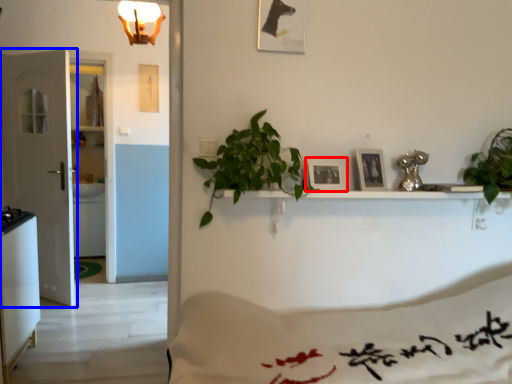
Question: Which object appears closest to the camera in this image, picture frame (highlighted by a red box) or door (highlighted by a blue box)?

Choices:
 (A) picture frame
 (B) door

Answer: (A)